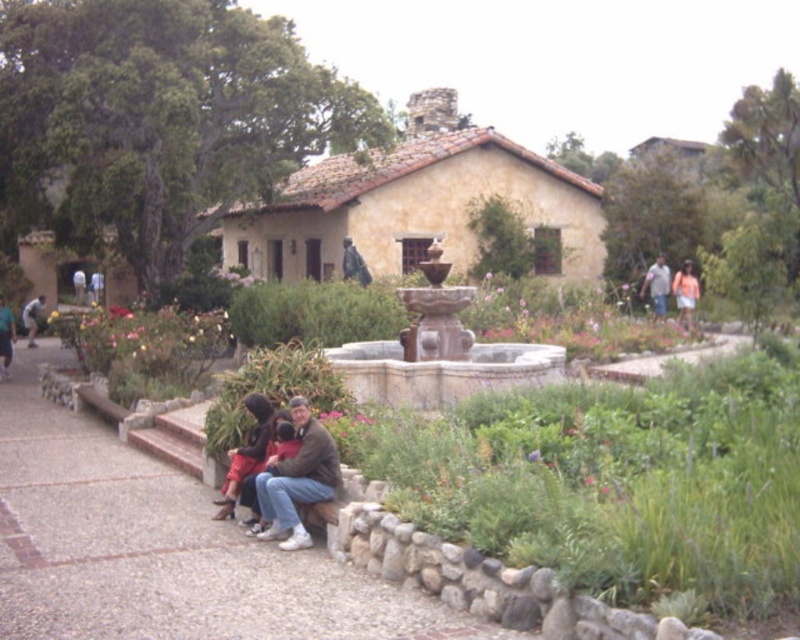
Is matte black jacket at lower center shorter than orange cotton shirt at right?

Yes, matte black jacket at lower center is shorter than orange cotton shirt at right.

Describe the element at coordinates (248, 452) in the screenshot. I see `matte black jacket at lower center` at that location.

Does point (256, 394) come closer to viewer compared to point (690, 310)?

Yes, it is.

Identify the location of matte black jacket at lower center. (248, 452).

Is smooth concrete bench at lower center shorter than matte brown jacket at lower center?

Indeed, smooth concrete bench at lower center has a lesser height compared to matte brown jacket at lower center.

Looking at this image, does smooth concrete bench at lower center have a smaller size compared to matte brown jacket at lower center?

Actually, smooth concrete bench at lower center might be larger than matte brown jacket at lower center.

Find the location of a particular element. This screenshot has width=800, height=640. smooth concrete bench at lower center is located at coordinates pyautogui.click(x=162, y=548).

Who is higher up, orange cotton dress at upper right or denim jacket at right?

Positioned higher is denim jacket at right.

Does orange cotton dress at upper right appear on the right side of denim jacket at right?

Correct, you'll find orange cotton dress at upper right to the right of denim jacket at right.

Image resolution: width=800 pixels, height=640 pixels. I want to click on orange cotton dress at upper right, so coord(686,292).

This screenshot has height=640, width=800. Identify the location of orange cotton dress at upper right. (686, 292).